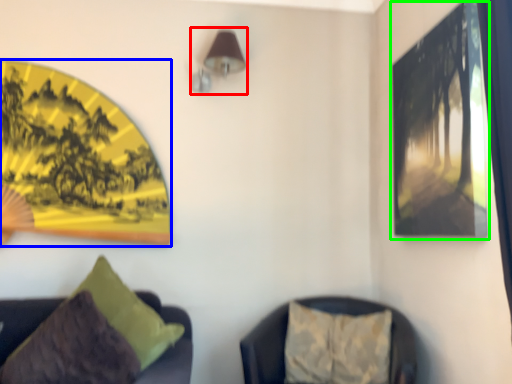
Question: Based on their relative distances, which object is farther from lamp (highlighted by a red box)? Choose from picture frame (highlighted by a blue box) and picture frame (highlighted by a green box).

Choices:
 (A) picture frame
 (B) picture frame

Answer: (B)